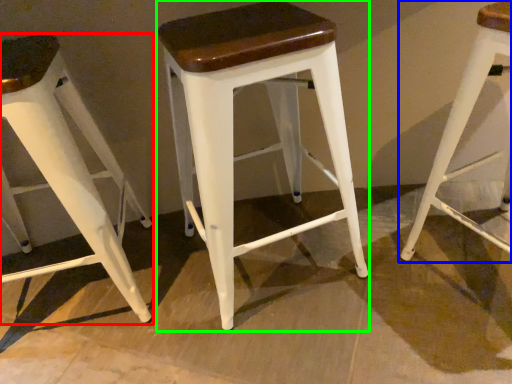
Question: Which object is positioned farthest from stool (highlighted by a red box)? Select from stool (highlighted by a blue box) and stool (highlighted by a green box).

Choices:
 (A) stool
 (B) stool

Answer: (A)